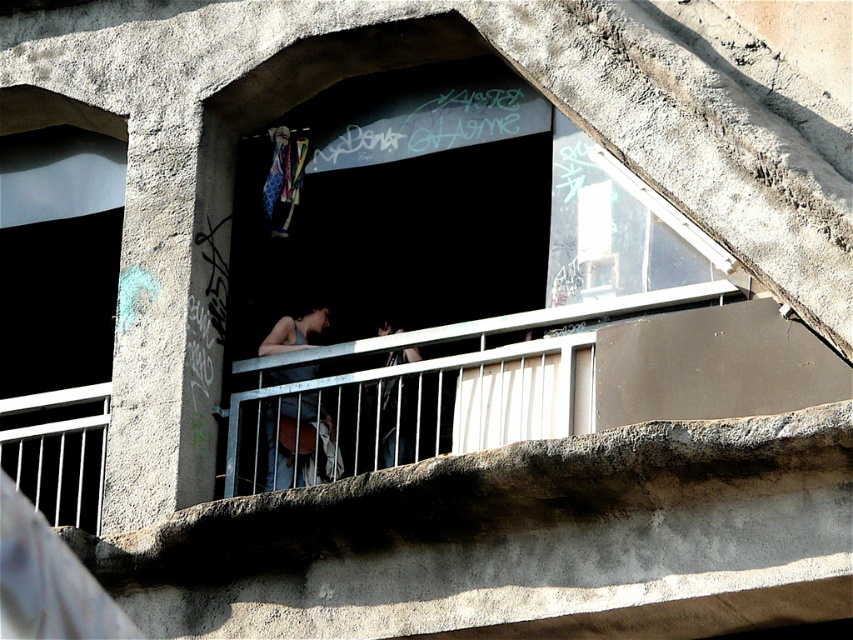
Does point (305, 328) come closer to viewer compared to point (384, 445)?

That is False.

Does point (276, 476) come in front of point (381, 396)?

Yes.

Locate an element on the screen. The image size is (853, 640). dark blue denim jeans at center is located at coordinates (280, 444).

Is transparent glass window at left behind dark blue denim jeans at center?

That is False.

Between transparent glass window at left and dark blue denim jeans at center, which one appears on the right side from the viewer's perspective?

dark blue denim jeans at center is more to the right.

Between point (22, 120) and point (303, 320), which one is positioned behind?

Point (22, 120)

Find the location of a particular element. The height and width of the screenshot is (640, 853). transparent glass window at left is located at coordinates (57, 296).

Between transparent glass window at left and dark blue jeans at center, which one appears on the right side from the viewer's perspective?

Positioned to the right is dark blue jeans at center.

Is point (39, 332) positioned before point (404, 349)?

No, it is not.

Identify the location of transparent glass window at left. The image size is (853, 640). (57, 296).